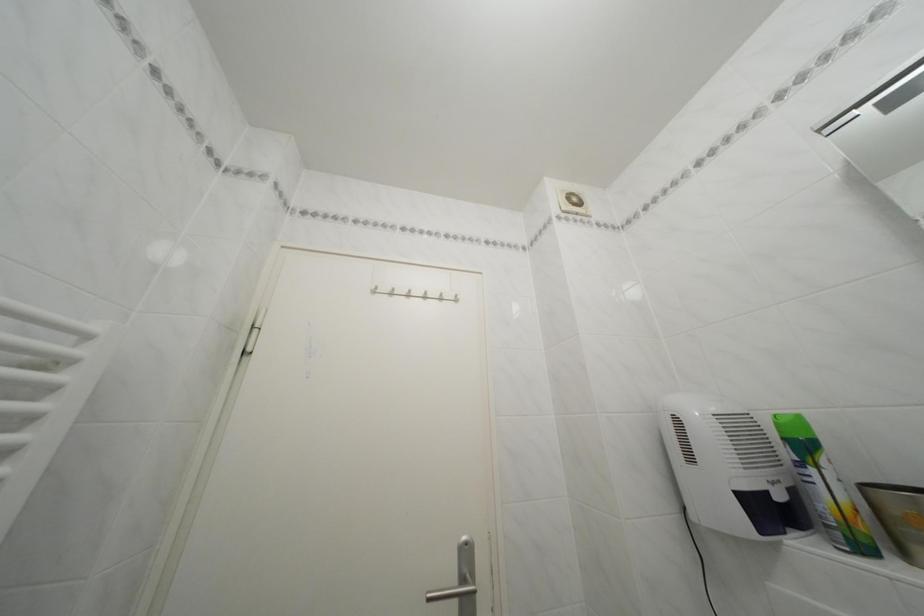
Where is `towel rack bar`? This screenshot has height=616, width=924. towel rack bar is located at coordinates (416, 293).